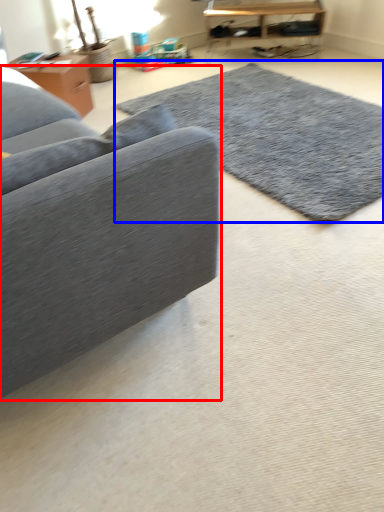
Question: Which of the following is the closest to the observer, studio couch (highlighted by a red box) or mat (highlighted by a blue box)?

Choices:
 (A) studio couch
 (B) mat

Answer: (A)